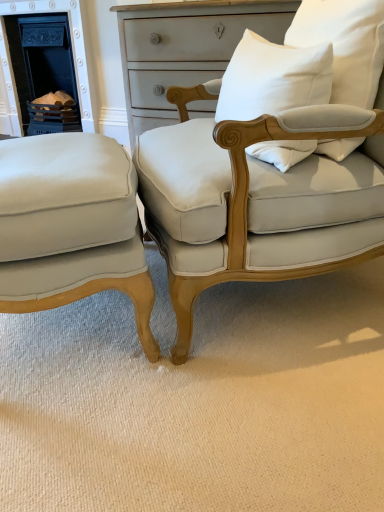
In order to face matte white fabric chair at center, marked as the 2th chair in a left-to-right arrangement, should I rotate leftwards or rightwards?

You should look right and rotate roughly 11.799 degrees.

Describe the element at coordinates (71, 226) in the screenshot. I see `matte cream fabric chair at lower left, the 2th chair when ordered from right to left` at that location.

What are the coordinates of `matte black fireplace at left` in the screenshot? It's located at (73, 58).

Locate an element on the screen. matte white fabric chair at center, the first chair from the right is located at coordinates pos(258,199).

Is matte cream fabric chair at lower left, the 2th chair when ordered from right to left, situated inside white cotton pillow at upper right, arranged as the second pillow when viewed from the left, or outside?

matte cream fabric chair at lower left, the 2th chair when ordered from right to left, cannot be found inside white cotton pillow at upper right, arranged as the second pillow when viewed from the left.

Is matte cream fabric chair at lower left, the 2th chair when ordered from right to left, taller or shorter than white cotton pillow at upper right, which ranks as the first pillow in right-to-left order?

Considering their sizes, matte cream fabric chair at lower left, the 2th chair when ordered from right to left, has more height than white cotton pillow at upper right, which ranks as the first pillow in right-to-left order.

Can you confirm if matte cream fabric chair at lower left, the first chair when ordered from left to right, is smaller than white cotton pillow at upper right, arranged as the second pillow when viewed from the left?

No.

Find the location of `the 2nd pillow above the matte cream fabric chair at lower left, the 2th chair when ordered from right to left (from the image's perspective)`. the 2nd pillow above the matte cream fabric chair at lower left, the 2th chair when ordered from right to left (from the image's perspective) is located at coordinates (345, 44).

From the image's perspective, which object appears higher, matte black fireplace at left or matte cream fabric chair at lower left, the 2th chair when ordered from right to left?

From the image's view, matte black fireplace at left is above.

Which of these two, matte black fireplace at left or matte cream fabric chair at lower left, the first chair when ordered from left to right, is smaller?

matte cream fabric chair at lower left, the first chair when ordered from left to right, is smaller.

Considering the positions of point (57, 9) and point (144, 324), is point (57, 9) closer or farther from the camera than point (144, 324)?

Point (57, 9) is farther from the camera than point (144, 324).

From a real-world perspective, is matte black fireplace at left physically below matte cream fabric chair at lower left, the 2th chair when ordered from right to left?

No.

Does white cotton pillow at upper right, marked as the 2th pillow in a right-to-left arrangement, have a greater width compared to white cotton pillow at upper right, arranged as the second pillow when viewed from the left?

No, white cotton pillow at upper right, marked as the 2th pillow in a right-to-left arrangement, is not wider than white cotton pillow at upper right, arranged as the second pillow when viewed from the left.

This screenshot has height=512, width=384. I want to click on pillow below the white cotton pillow at upper right, which ranks as the first pillow in right-to-left order (from the image's perspective), so click(x=273, y=78).

Who is shorter, white cotton pillow at upper right, marked as the 2th pillow in a right-to-left arrangement, or white cotton pillow at upper right, which ranks as the first pillow in right-to-left order?

With less height is white cotton pillow at upper right, marked as the 2th pillow in a right-to-left arrangement.

Is white cotton pillow at upper right, placed as the first pillow when sorted from left to right, oriented away from white cotton pillow at upper right, arranged as the second pillow when viewed from the left?

Yes.

Which is less distant, (208, 167) or (255, 91)?

Clearly, point (208, 167) is more distant from the camera than point (255, 91).

Considering the sizes of objects matte white fabric chair at center, marked as the 2th chair in a left-to-right arrangement, and white cotton pillow at upper right, placed as the first pillow when sorted from left to right, in the image provided, who is thinner, matte white fabric chair at center, marked as the 2th chair in a left-to-right arrangement, or white cotton pillow at upper right, placed as the first pillow when sorted from left to right,?

With smaller width is white cotton pillow at upper right, placed as the first pillow when sorted from left to right.

From the picture: Is matte white fabric chair at center, the first chair from the right, not within white cotton pillow at upper right, placed as the first pillow when sorted from left to right?

Yes, matte white fabric chair at center, the first chair from the right, is located beyond the bounds of white cotton pillow at upper right, placed as the first pillow when sorted from left to right.

Does matte black fireplace at left touch white cotton pillow at upper right, which ranks as the first pillow in right-to-left order?

No, matte black fireplace at left is not beside white cotton pillow at upper right, which ranks as the first pillow in right-to-left order.

Considering the sizes of matte black fireplace at left and white cotton pillow at upper right, arranged as the second pillow when viewed from the left, in the image, is matte black fireplace at left taller or shorter than white cotton pillow at upper right, arranged as the second pillow when viewed from the left,?

Considering their sizes, matte black fireplace at left has more height than white cotton pillow at upper right, arranged as the second pillow when viewed from the left.

Which is in front, matte black fireplace at left or white cotton pillow at upper right, arranged as the second pillow when viewed from the left?

white cotton pillow at upper right, arranged as the second pillow when viewed from the left, is in front.

From a real-world perspective, which is physically below, matte black fireplace at left or white cotton pillow at upper right, which ranks as the first pillow in right-to-left order?

matte black fireplace at left.

Considering the sizes of objects matte cream fabric chair at lower left, the 2th chair when ordered from right to left, and matte white fabric chair at center, the first chair from the right, in the image provided, who is wider, matte cream fabric chair at lower left, the 2th chair when ordered from right to left, or matte white fabric chair at center, the first chair from the right,?

matte white fabric chair at center, the first chair from the right, is wider.

Is matte cream fabric chair at lower left, the 2th chair when ordered from right to left, outside of matte white fabric chair at center, marked as the 2th chair in a left-to-right arrangement?

Yes.

How much distance is there between matte cream fabric chair at lower left, the first chair when ordered from left to right, and matte white fabric chair at center, marked as the 2th chair in a left-to-right arrangement?

A distance of 9.08 inches exists between matte cream fabric chair at lower left, the first chair when ordered from left to right, and matte white fabric chair at center, marked as the 2th chair in a left-to-right arrangement.

Is matte cream fabric chair at lower left, the 2th chair when ordered from right to left, far from matte white fabric chair at center, the first chair from the right?

matte cream fabric chair at lower left, the 2th chair when ordered from right to left, is actually quite close to matte white fabric chair at center, the first chair from the right.

Considering the positions of objects white cotton pillow at upper right, which ranks as the first pillow in right-to-left order, and matte cream fabric chair at lower left, the first chair when ordered from left to right, in the image provided, who is more to the right, white cotton pillow at upper right, which ranks as the first pillow in right-to-left order, or matte cream fabric chair at lower left, the first chair when ordered from left to right,?

white cotton pillow at upper right, which ranks as the first pillow in right-to-left order.

Is white cotton pillow at upper right, which ranks as the first pillow in right-to-left order, taller or shorter than matte cream fabric chair at lower left, the 2th chair when ordered from right to left?

Considering their sizes, white cotton pillow at upper right, which ranks as the first pillow in right-to-left order, has less height than matte cream fabric chair at lower left, the 2th chair when ordered from right to left.

Between white cotton pillow at upper right, which ranks as the first pillow in right-to-left order, and matte cream fabric chair at lower left, the first chair when ordered from left to right, which one has larger width?

Wider between the two is matte cream fabric chair at lower left, the first chair when ordered from left to right.

Image resolution: width=384 pixels, height=512 pixels. What are the coordinates of `the 2nd pillow directly above the matte cream fabric chair at lower left, the 2th chair when ordered from right to left (from a real-world perspective)` in the screenshot? It's located at (345, 44).

The width and height of the screenshot is (384, 512). Identify the location of the 1st chair counting from the right of the matte black fireplace at left. (71, 226).

Estimate the real-world distances between objects in this image. Which object is further from white cotton pillow at upper right, marked as the 2th pillow in a right-to-left arrangement, matte black fireplace at left or matte cream fabric chair at lower left, the first chair when ordered from left to right?

matte black fireplace at left is positioned further to the anchor white cotton pillow at upper right, marked as the 2th pillow in a right-to-left arrangement.

When comparing their distances from matte cream fabric chair at lower left, the 2th chair when ordered from right to left, does matte black fireplace at left or white cotton pillow at upper right, which ranks as the first pillow in right-to-left order, seem further?

matte black fireplace at left is positioned further to the anchor matte cream fabric chair at lower left, the 2th chair when ordered from right to left.

From the image, which object appears to be nearer to matte cream fabric chair at lower left, the first chair when ordered from left to right, matte white fabric chair at center, marked as the 2th chair in a left-to-right arrangement, or white cotton pillow at upper right, placed as the first pillow when sorted from left to right?

The object closer to matte cream fabric chair at lower left, the first chair when ordered from left to right, is matte white fabric chair at center, marked as the 2th chair in a left-to-right arrangement.

Considering their positions, is white cotton pillow at upper right, arranged as the second pillow when viewed from the left, positioned closer to matte cream fabric chair at lower left, the 2th chair when ordered from right to left, than matte white fabric chair at center, marked as the 2th chair in a left-to-right arrangement?

matte white fabric chair at center, marked as the 2th chair in a left-to-right arrangement.

Based on their spatial positions, is matte black fireplace at left or matte white fabric chair at center, marked as the 2th chair in a left-to-right arrangement, closer to white cotton pillow at upper right, marked as the 2th pillow in a right-to-left arrangement?

Based on the image, matte white fabric chair at center, marked as the 2th chair in a left-to-right arrangement, appears to be nearer to white cotton pillow at upper right, marked as the 2th pillow in a right-to-left arrangement.

Based on the photo, considering their positions, is white cotton pillow at upper right, which ranks as the first pillow in right-to-left order, positioned closer to matte black fireplace at left than matte cream fabric chair at lower left, the first chair when ordered from left to right?

Among the two, matte cream fabric chair at lower left, the first chair when ordered from left to right, is located nearer to matte black fireplace at left.

Considering their positions, is white cotton pillow at upper right, placed as the first pillow when sorted from left to right, positioned closer to matte white fabric chair at center, the first chair from the right, than matte cream fabric chair at lower left, the 2th chair when ordered from right to left?

Among the two, white cotton pillow at upper right, placed as the first pillow when sorted from left to right, is located nearer to matte white fabric chair at center, the first chair from the right.

Estimate the real-world distances between objects in this image. Which object is further from matte black fireplace at left, matte white fabric chair at center, the first chair from the right, or white cotton pillow at upper right, marked as the 2th pillow in a right-to-left arrangement?

matte white fabric chair at center, the first chair from the right, lies further to matte black fireplace at left than the other object.

This screenshot has height=512, width=384. What are the coordinates of `pillow between matte cream fabric chair at lower left, the first chair when ordered from left to right, and white cotton pillow at upper right, which ranks as the first pillow in right-to-left order` in the screenshot? It's located at (273, 78).

Identify the location of pillow between white cotton pillow at upper right, which ranks as the first pillow in right-to-left order, and matte white fabric chair at center, the first chair from the right, in the vertical direction. The image size is (384, 512). (x=273, y=78).

I want to click on pillow between matte cream fabric chair at lower left, the first chair when ordered from left to right, and matte white fabric chair at center, the first chair from the right, in the horizontal direction, so click(x=273, y=78).

Find the location of a particular element. This screenshot has height=512, width=384. chair between matte white fabric chair at center, the first chair from the right, and matte black fireplace at left, along the z-axis is located at coordinates (71, 226).